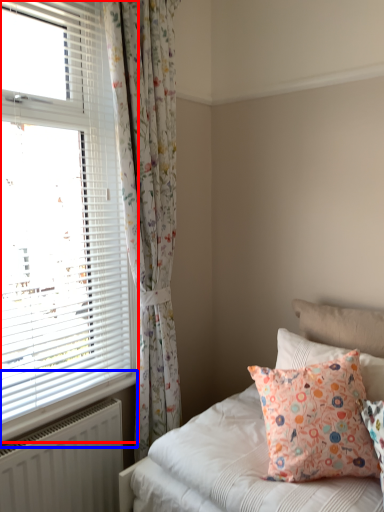
Question: Which point is closer to the camera, window (highlighted by a red box) or window sill (highlighted by a blue box)?

Choices:
 (A) window
 (B) window sill

Answer: (A)